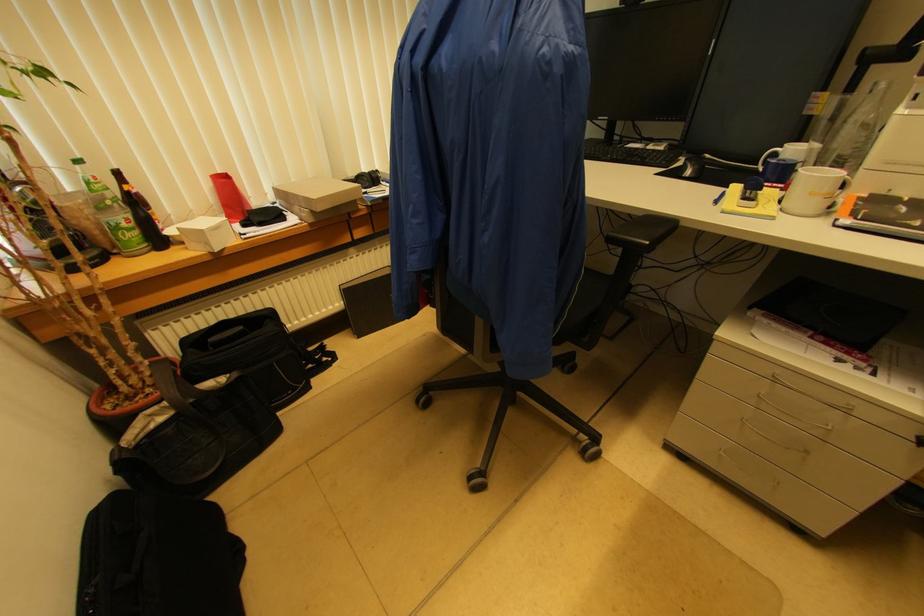
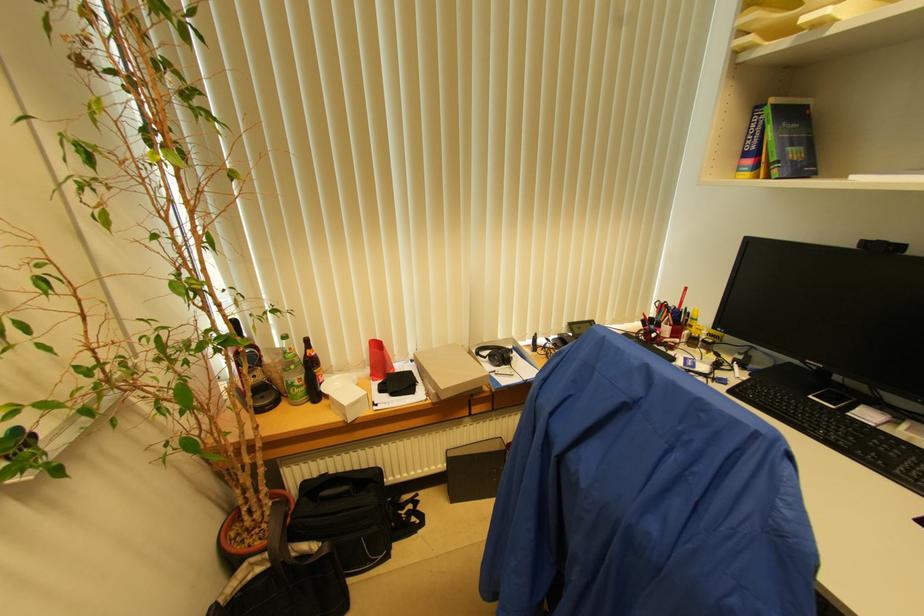
Find the pixel in the second image that matches [131,219] in the first image.

(304, 379)